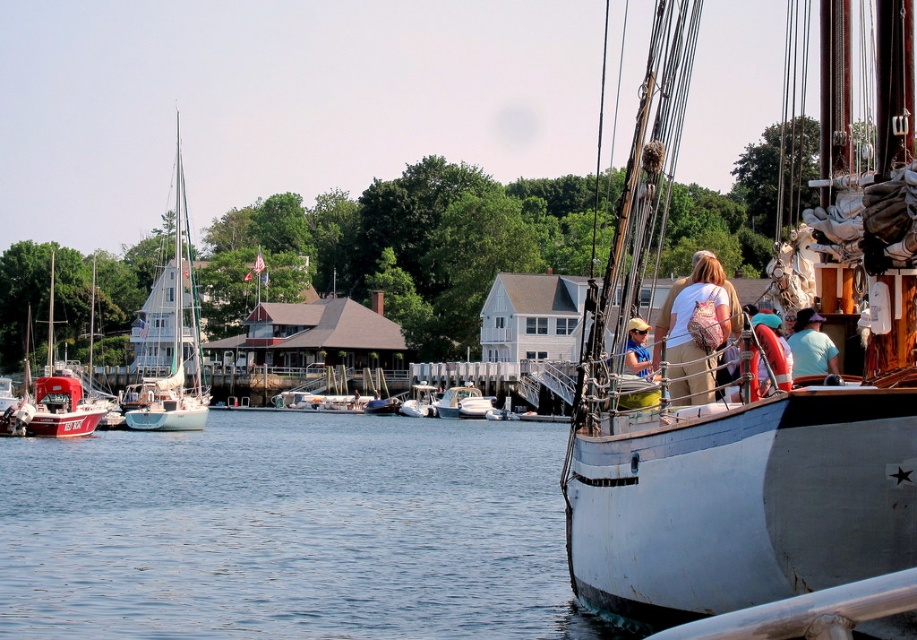
You are standing on the pier and see the point marked at coordinates (x=750, y=378). What object does this point indicate?

The point marked at coordinates (x=750, y=378) indicates the white matte sailboat at center.